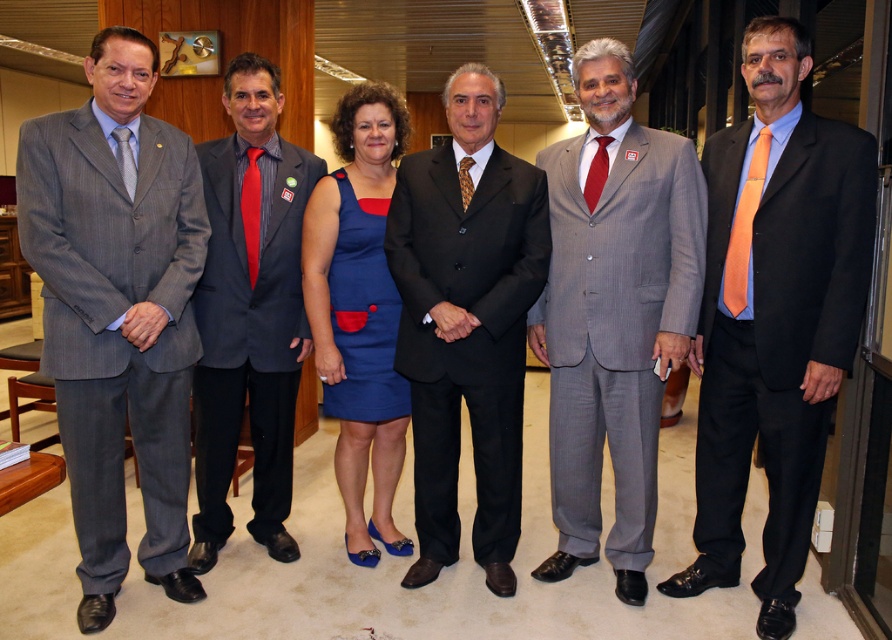
You are organizing a photo shoot and need to arrange the black satin suit at center and the blue fabric dress at center on a mannequin. Which one requires a smaller mannequin?

The black satin suit at center requires a smaller mannequin because it is smaller than the blue fabric dress at center.

You are a photographer at a formal event. You need to arrange two subjects wearing the gray pinstripe suit at left and the orange silk suit at right. Which subject should you place on the left side of the photo to match their current positions?

The gray pinstripe suit at left should be placed on the left side of the photo because it is already positioned on the left side of the orange silk suit at right in the current arrangement.

Based on the photo, you are a photographer at the event and need to position the gray pinstripe suit at left and orange silk suit at right in a group photo. Considering their heights, which person should stand in the back to avoid blocking others?

The gray pinstripe suit at left should stand in the back because it has a greater height compared to the orange silk suit at right.